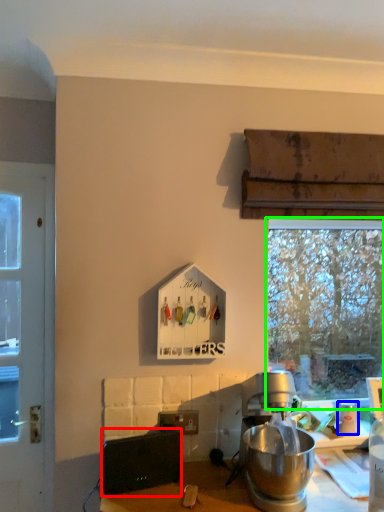
Question: Based on their relative distances, which object is nearer to appliance (highlighted by a red box)? Choose from coffee cup (highlighted by a blue box) and window (highlighted by a green box).

Choices:
 (A) coffee cup
 (B) window

Answer: (A)